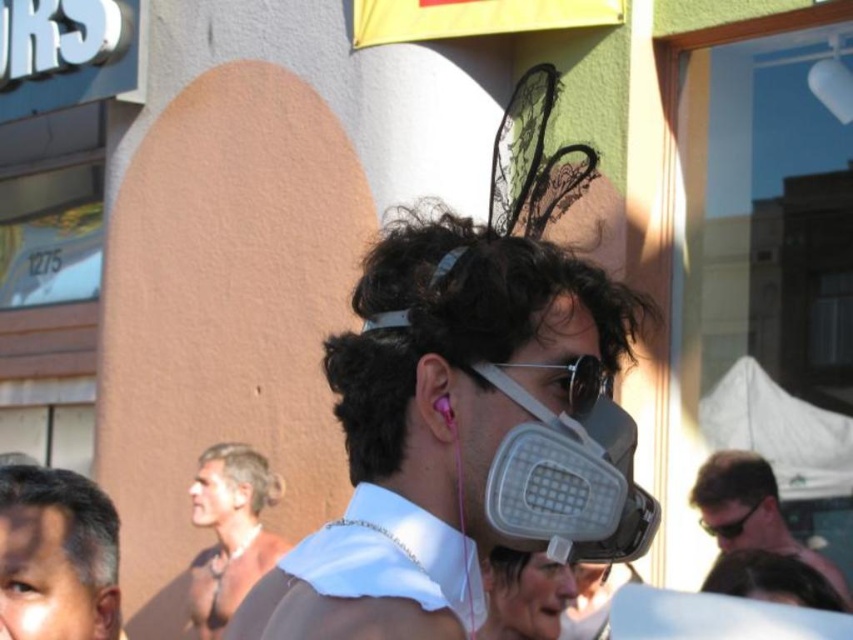
Is gray matte gas mask at center thinner than gray matte goggles at center?

In fact, gray matte gas mask at center might be wider than gray matte goggles at center.

Based on the photo, does gray matte gas mask at center appear under gray matte goggles at center?

No, gray matte gas mask at center is not below gray matte goggles at center.

This screenshot has height=640, width=853. I want to click on gray matte gas mask at center, so click(x=566, y=387).

Find the location of `gray matte gas mask at center`. gray matte gas mask at center is located at coordinates (566, 387).

Which is more to the right, light brown hair at center or dark brown curly hair at upper center?

From the viewer's perspective, dark brown curly hair at upper center appears more on the right side.

Which is in front, point (212, 604) or point (836, 600)?

Positioned in front is point (836, 600).

Does point (219, 449) come farther from viewer compared to point (780, 556)?

Yes, point (219, 449) is behind point (780, 556).

Identify the location of light brown hair at center. (230, 531).

Is gray matte mask at lower left smaller than gray matte goggles at center?

No.

Between gray matte mask at lower left and gray matte goggles at center, which one is positioned higher?

gray matte mask at lower left is higher up.

Which is behind, point (56, 589) or point (708, 532)?

The point (708, 532) is behind.

At what (x,y) coordinates should I click in order to perform the action: click on gray matte mask at lower left. Please return your answer as a coordinate pair (x, y). Image resolution: width=853 pixels, height=640 pixels. Looking at the image, I should click on tap(56, 556).